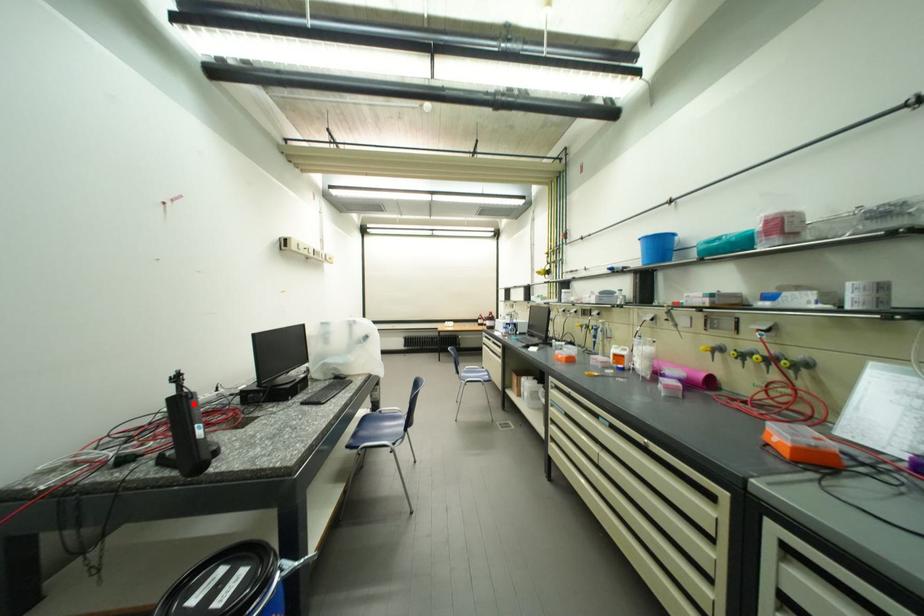
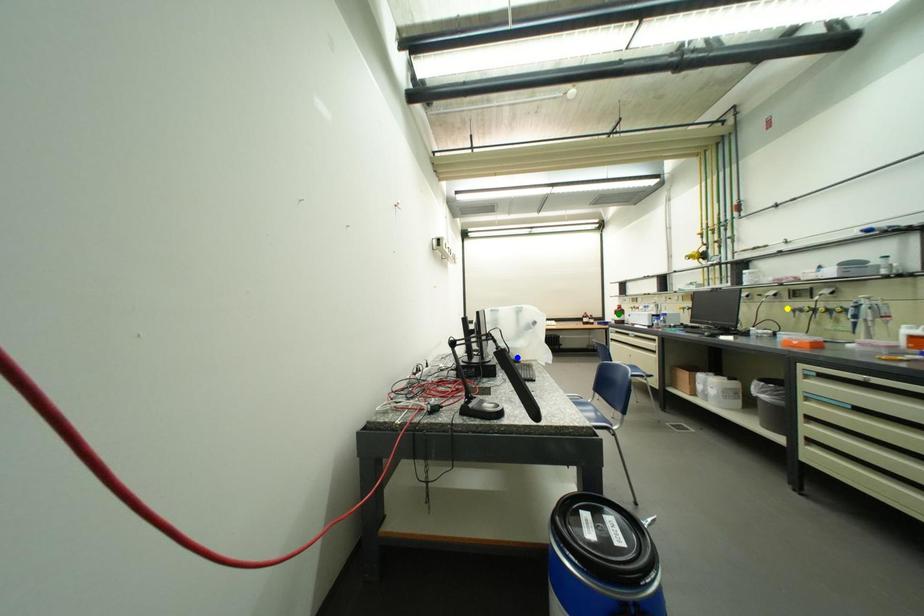
Question: I am providing you with two images of the same scene from different viewpoints. A red point is marked on the first image. You are given multiple points on the second image. Can you choose the point in image 2 that corresponds to the point in image 1?

Choices:
 (A) green point
 (B) yellow point
 (C) blue point

Answer: (C)